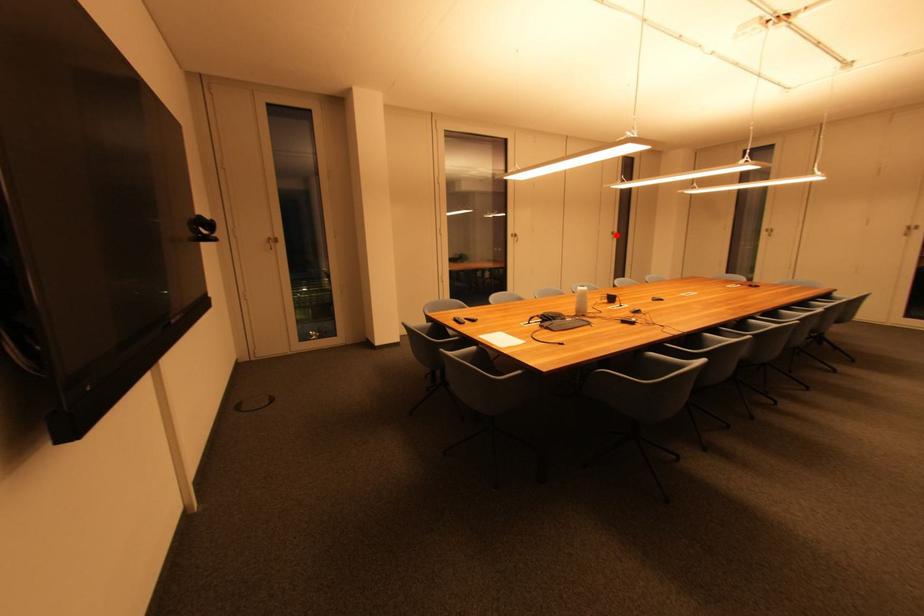
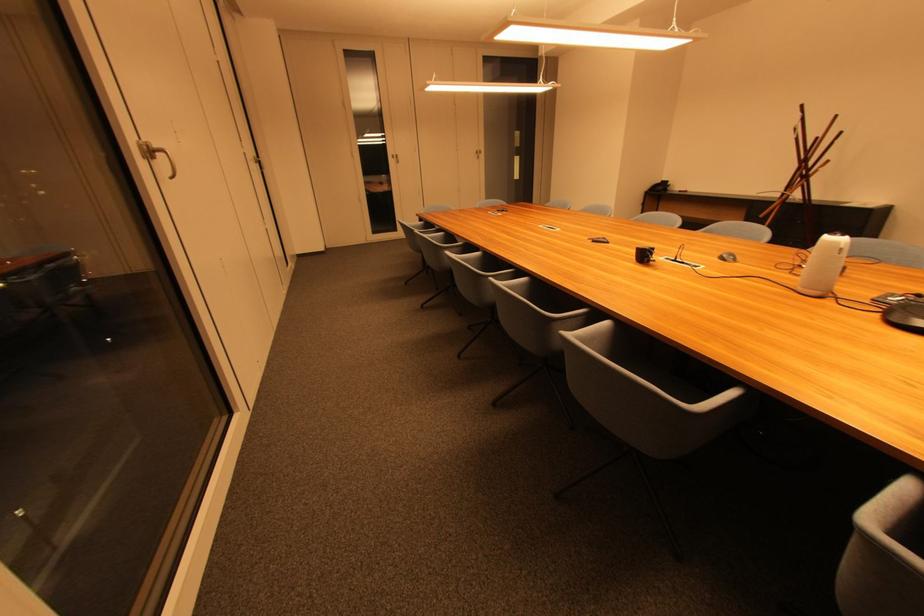
Where in the second image is the point corresponding to the highlighted location from the first image?

(259, 163)